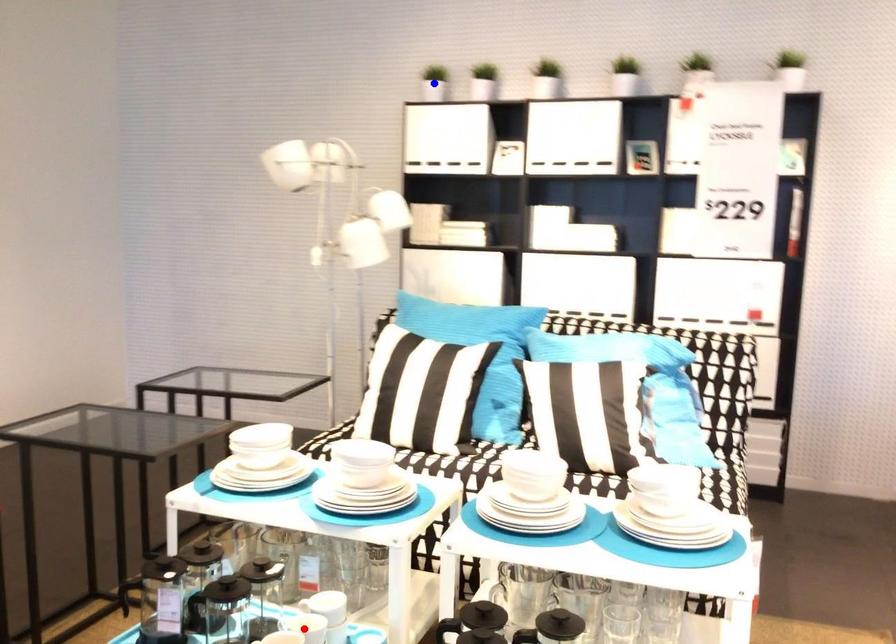
Question: Which of the two points in the image is closer to the camera?

Choices:
 (A) Blue point is closer.
 (B) Red point is closer.

Answer: (B)